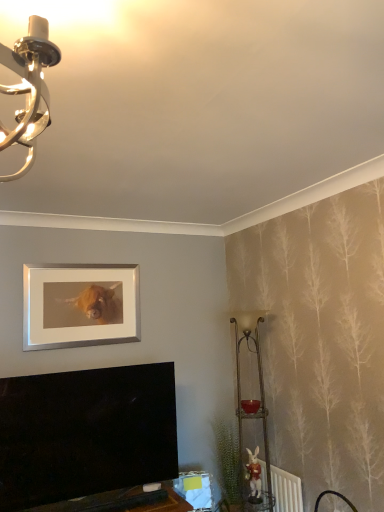
Question: Considering the relative sizes of silver/metallic picture frame at upper center and green leafy plant at lower right in the image provided, is silver/metallic picture frame at upper center thinner than green leafy plant at lower right?

Choices:
 (A) no
 (B) yes

Answer: (B)

Question: Is silver/metallic picture frame at upper center outside of green leafy plant at lower right?

Choices:
 (A) no
 (B) yes

Answer: (B)

Question: Can you confirm if silver/metallic picture frame at upper center is positioned to the left of green leafy plant at lower right?

Choices:
 (A) yes
 (B) no

Answer: (A)

Question: Does silver/metallic picture frame at upper center lie behind green leafy plant at lower right?

Choices:
 (A) yes
 (B) no

Answer: (B)

Question: Is silver/metallic picture frame at upper center beside green leafy plant at lower right?

Choices:
 (A) no
 (B) yes

Answer: (A)

Question: Can you confirm if silver/metallic picture frame at upper center is taller than green leafy plant at lower right?

Choices:
 (A) no
 (B) yes

Answer: (A)

Question: Does metallic gold table lamp at right have a smaller size compared to green leafy plant at lower right?

Choices:
 (A) yes
 (B) no

Answer: (B)

Question: Does metallic gold table lamp at right appear on the right side of green leafy plant at lower right?

Choices:
 (A) no
 (B) yes

Answer: (B)

Question: From a real-world perspective, is metallic gold table lamp at right over green leafy plant at lower right?

Choices:
 (A) no
 (B) yes

Answer: (B)

Question: Does metallic gold table lamp at right touch green leafy plant at lower right?

Choices:
 (A) yes
 (B) no

Answer: (B)

Question: Considering the relative sizes of metallic gold table lamp at right and green leafy plant at lower right in the image provided, is metallic gold table lamp at right thinner than green leafy plant at lower right?

Choices:
 (A) no
 (B) yes

Answer: (A)

Question: Can you confirm if metallic gold table lamp at right is bigger than green leafy plant at lower right?

Choices:
 (A) no
 (B) yes

Answer: (B)

Question: From a real-world perspective, is white plastic radiator at lower right positioned under silver/metallic picture frame at upper center based on gravity?

Choices:
 (A) yes
 (B) no

Answer: (A)